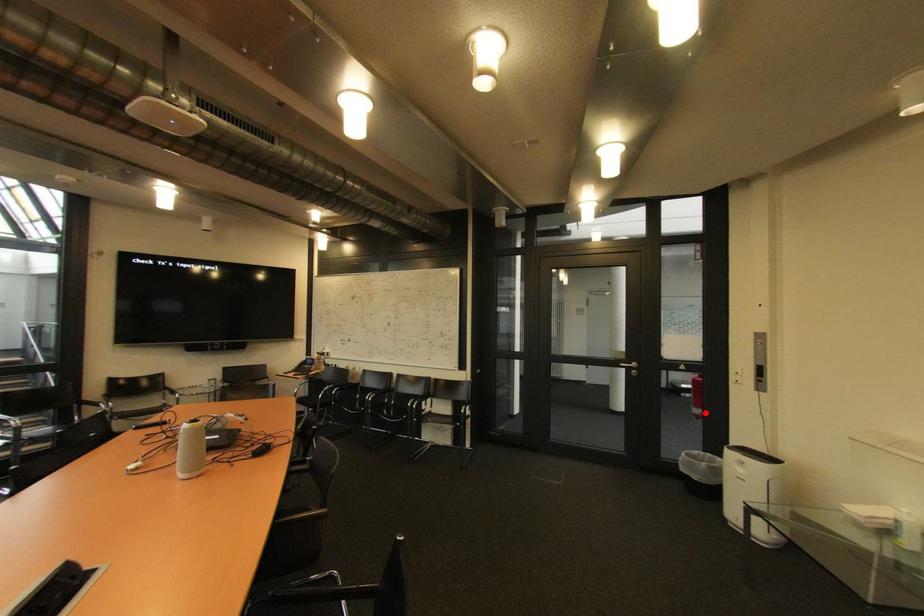
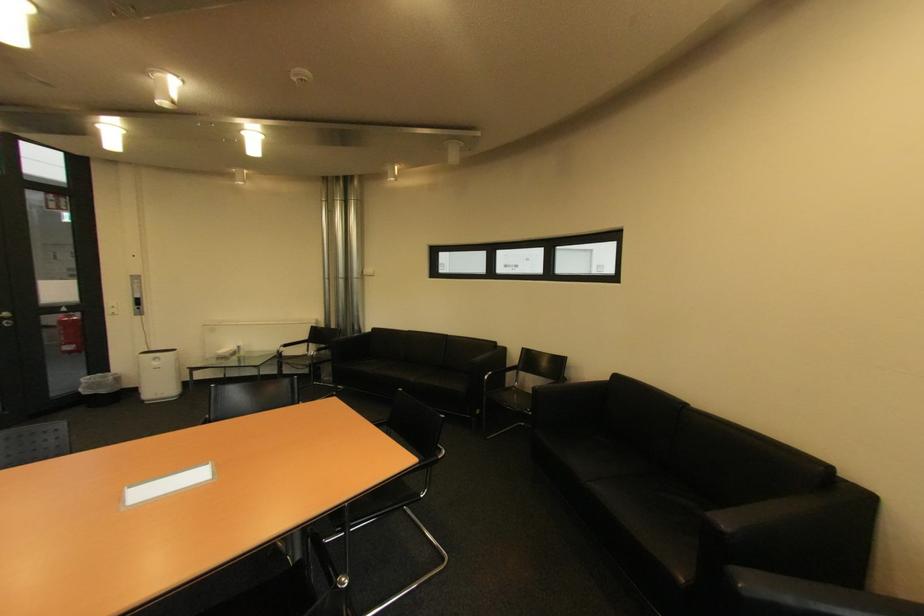
Question: I am providing you with two images of the same scene from different viewpoints. Image1 has a red point marked. In image2, the corresponding 3D location appears at what relative position? Reply with the corresponding letter.

Choices:
 (A) Closer
 (B) Farther

Answer: (A)